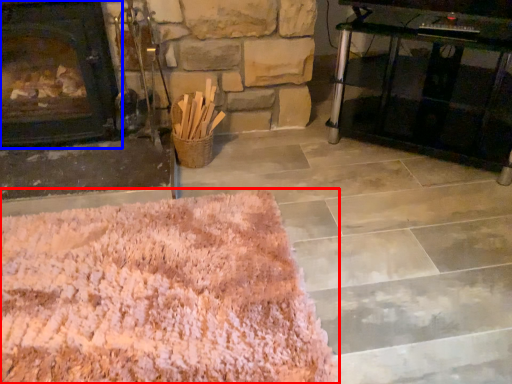
Question: Which object is closer to the camera taking this photo, mat (highlighted by a red box) or fireplace (highlighted by a blue box)?

Choices:
 (A) mat
 (B) fireplace

Answer: (A)